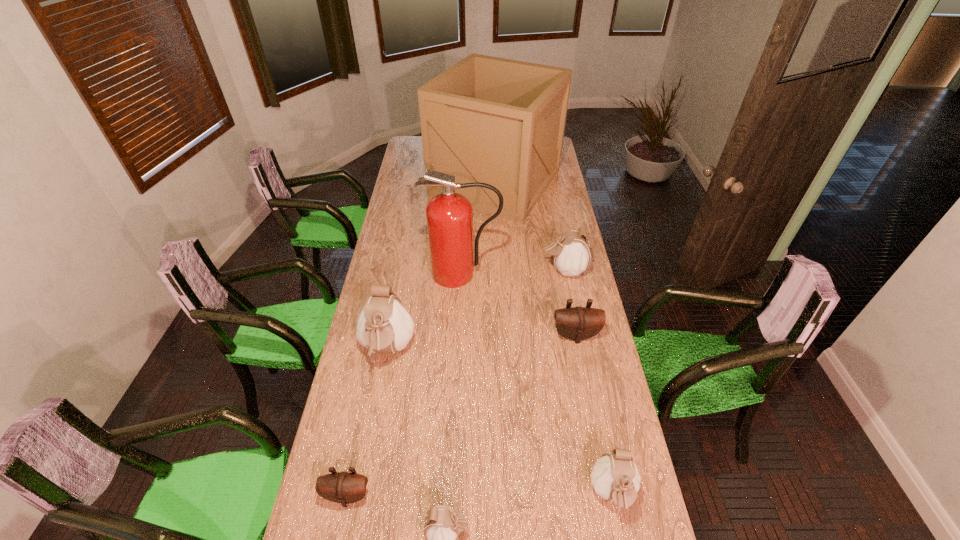
Locate an element on the screen. This screenshot has height=540, width=960. object positioned at the far edge is located at coordinates (486, 119).

The width and height of the screenshot is (960, 540). What are the coordinates of `box situated at the right edge` in the screenshot? It's located at (486, 119).

Where is `object present at the far right corner`? The image size is (960, 540). object present at the far right corner is located at coordinates [x=486, y=119].

You are a GUI agent. You are given a task and a screenshot of the screen. Output one action in this format:
    pyautogui.click(x=<x>, y=<y>)
    Task: Click on the free space at the left edge of the desktop
    This screenshot has width=960, height=540.
    Given the screenshot: What is the action you would take?
    coord(402,288)

This screenshot has width=960, height=540. I want to click on vacant area at the right edge of the desktop, so click(x=544, y=216).

Find the location of `vacant space at the far left corner of the desktop`. vacant space at the far left corner of the desktop is located at coordinates (420, 145).

Where is `free space between the third tallest object and the fire extinguisher`? free space between the third tallest object and the fire extinguisher is located at coordinates (425, 312).

The width and height of the screenshot is (960, 540). Find the location of `unoccupied area between the third smallest white pouch and the red fire extinguisher`. unoccupied area between the third smallest white pouch and the red fire extinguisher is located at coordinates (513, 272).

I want to click on free space between the farthest white pouch and the leftmost white pouch, so click(x=476, y=310).

Identify the location of free point between the left brown pouch and the red fire extinguisher. The height and width of the screenshot is (540, 960). (405, 384).